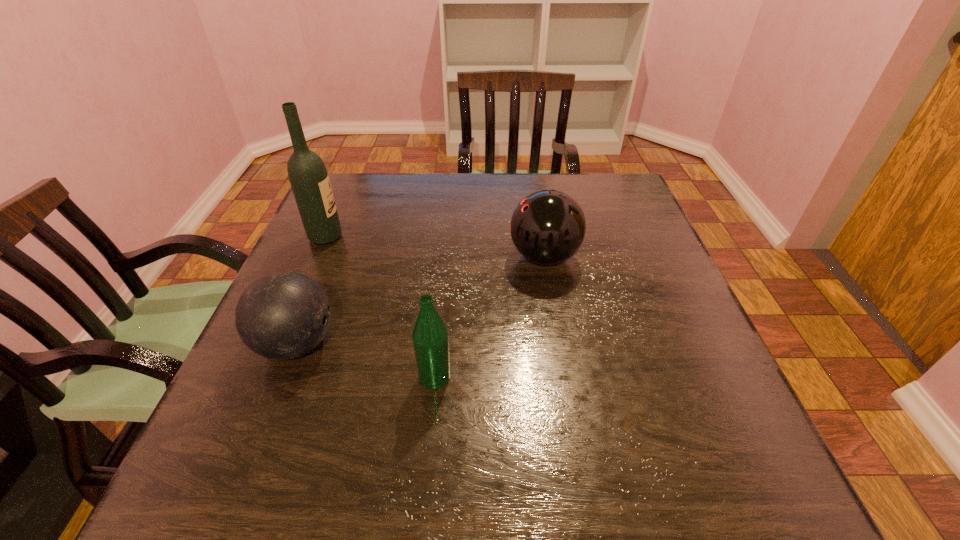
Where is `vacant position in the image that satisfies the following two spatial constraints: 1. on the surface of the right bowling ball near the finger holes; 2. on the front side of the bottle`? vacant position in the image that satisfies the following two spatial constraints: 1. on the surface of the right bowling ball near the finger holes; 2. on the front side of the bottle is located at coordinates (564, 377).

This screenshot has height=540, width=960. I want to click on vacant space that satisfies the following two spatial constraints: 1. on the grip area of the left bowling ball; 2. on the right side of the bottle, so tap(283, 377).